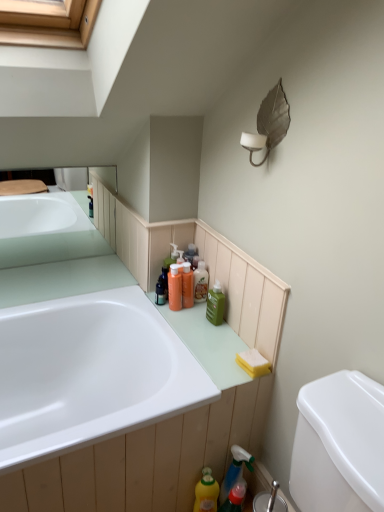
I want to click on vacant space to the left of translucent orange bottle at center, which is the 2th toiletry from left to right, so click(150, 300).